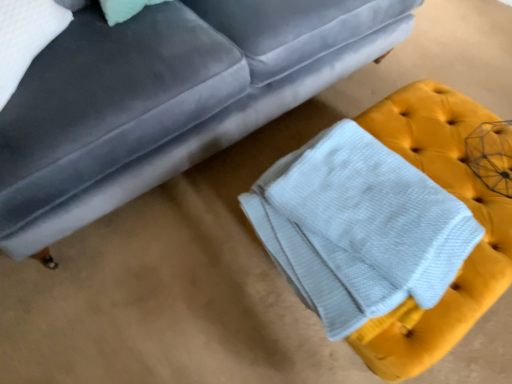
Question: Relative to white textured bath towel at lower right, is velvet gray couch at upper center in front or behind?

Choices:
 (A) front
 (B) behind

Answer: (A)

Question: Looking at the image, does velvet gray couch at upper center seem bigger or smaller compared to white textured bath towel at lower right?

Choices:
 (A) big
 (B) small

Answer: (A)

Question: From a real-world perspective, is velvet gray couch at upper center physically located above or below white textured bath towel at lower right?

Choices:
 (A) below
 (B) above

Answer: (B)

Question: From the image's perspective, is white textured bath towel at lower right positioned above or below velvet gray couch at upper center?

Choices:
 (A) below
 (B) above

Answer: (A)

Question: Is white textured bath towel at lower right wider or thinner than velvet gray couch at upper center?

Choices:
 (A) wide
 (B) thin

Answer: (B)

Question: Considering the positions of point (321, 195) and point (110, 137), is point (321, 195) closer or farther from the camera than point (110, 137)?

Choices:
 (A) farther
 (B) closer

Answer: (B)

Question: Relative to velvet gray couch at upper center, is white textured bath towel at lower right in front or behind?

Choices:
 (A) front
 (B) behind

Answer: (B)